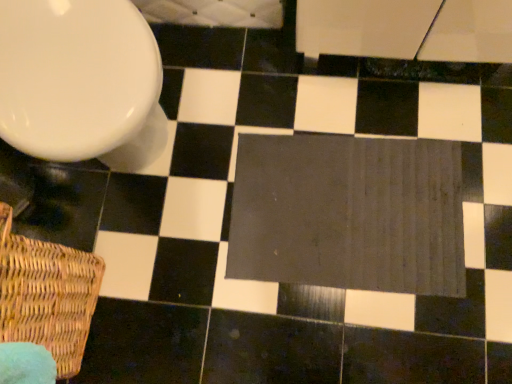
Locate an element on the screen. vacant space situated above dark gray fabric bath mat at center (from a real-world perspective) is located at coordinates (344, 210).